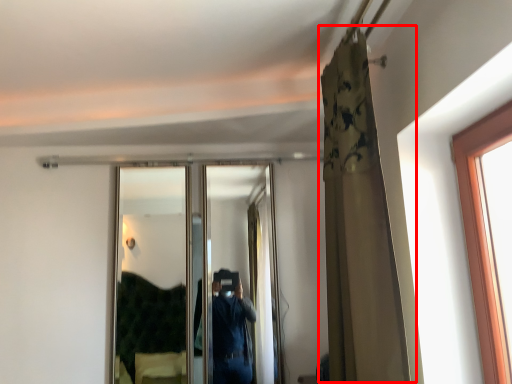
Question: From the image's perspective, considering the relative positions of curtain (annotated by the red box) and mirror in the image provided, where is curtain (annotated by the red box) located with respect to the staircase?

Choices:
 (A) below
 (B) above

Answer: (B)